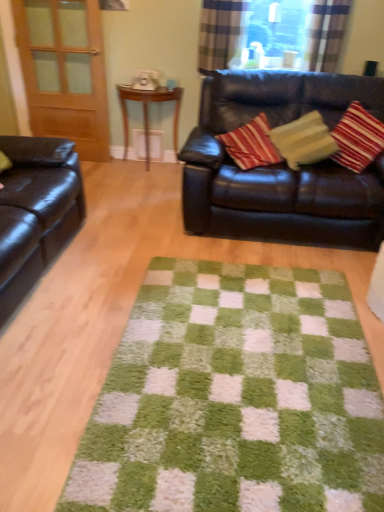
The width and height of the screenshot is (384, 512). I want to click on free space in front of wooden side table at center, so click(137, 183).